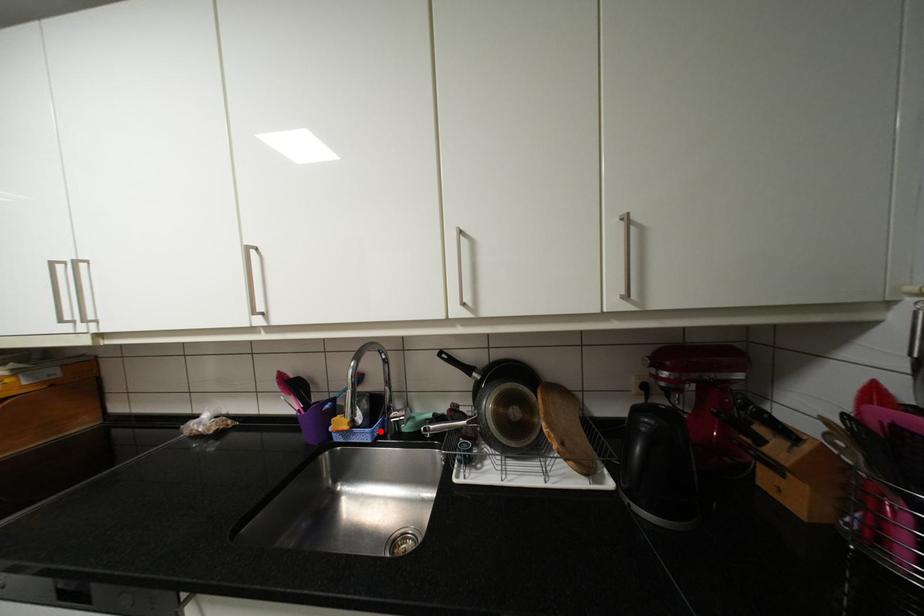
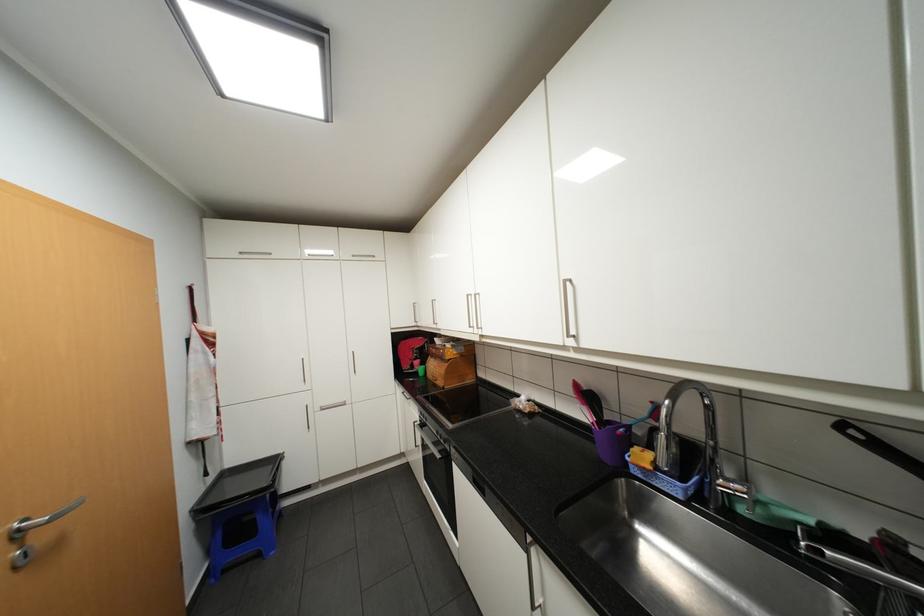
Find the pixel in the second image that matches the highlighted location in the first image.

(694, 488)